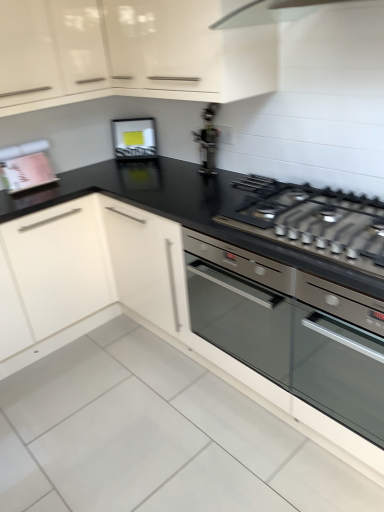
You are a GUI agent. You are given a task and a screenshot of the screen. Output one action in this format:
    pyautogui.click(x=<x>, y=<y>)
    Task: Click on the metallic silver toaster at upper center, placed as the first appliance when sorted from right to left
    Image resolution: width=384 pixels, height=512 pixels.
    Given the screenshot: What is the action you would take?
    pyautogui.click(x=208, y=140)

In order to face pink matte book at upper left, the first appliance from the left, should I rotate leftwards or rightwards?

To align with it, rotate left about 20.873°.

The image size is (384, 512). Describe the element at coordinates (134, 138) in the screenshot. I see `matte black frame at upper center, the 2th appliance positioned from the left` at that location.

What do you see at coordinates (128, 53) in the screenshot? I see `glossy white cabinet at upper center` at bounding box center [128, 53].

I want to click on metallic silver toaster at upper center, the third appliance viewed from the left, so click(208, 140).

Is matte black frame at upper center, the 2th appliance positioned from the left, next to metallic silver toaster at upper center, placed as the first appliance when sorted from right to left?

matte black frame at upper center, the 2th appliance positioned from the left, and metallic silver toaster at upper center, placed as the first appliance when sorted from right to left, are not in contact.

At what (x,y) coordinates should I click in order to perform the action: click on appliance that appears above the matte black frame at upper center, the 2th appliance positioned from the left (from a real-world perspective). Please return your answer as a coordinate pair (x, y). The height and width of the screenshot is (512, 384). Looking at the image, I should click on (208, 140).

Is matte black frame at upper center, the second appliance from the right, smaller than metallic silver toaster at upper center, placed as the first appliance when sorted from right to left?

Yes.

Which object is further away from the camera taking this photo, matte black frame at upper center, the second appliance from the right, or metallic silver toaster at upper center, placed as the first appliance when sorted from right to left?

matte black frame at upper center, the second appliance from the right, is further from the camera.

From the picture: From a real-world perspective, which object rests below the other?

satin silver oven at center is physically lower.

Is matte black frame at upper center, the second appliance from the right, at the left side of satin silver oven at center?

Indeed, matte black frame at upper center, the second appliance from the right, is positioned on the left side of satin silver oven at center.

Which is closer, (134, 139) or (239, 313)?

The point (239, 313) is closer to the camera.

Is matte black frame at upper center, the 2th appliance positioned from the left, in contact with satin silver oven at center?

No, matte black frame at upper center, the 2th appliance positioned from the left, is not touching satin silver oven at center.

Does pink matte book at upper left, which appears as the 3th appliance when viewed from the right, have a larger size compared to glossy white cabinet at upper center?

No.

Starting from the glossy white cabinet at upper center, which appliance is the 2nd one behind? Please provide its 2D coordinates.

[(26, 166)]

From the image's perspective, would you say pink matte book at upper left, which appears as the 3th appliance when viewed from the right, is shown under glossy white cabinet at upper center?

Yes, from the image's perspective, pink matte book at upper left, which appears as the 3th appliance when viewed from the right, is beneath glossy white cabinet at upper center.

Is pink matte book at upper left, the first appliance from the left, not close to glossy white cabinet at upper center?

Actually, pink matte book at upper left, the first appliance from the left, and glossy white cabinet at upper center are a little close together.

Considering the points (209, 166) and (232, 330), which point is in front, point (209, 166) or point (232, 330)?

Point (232, 330)

From the image's perspective, is metallic silver toaster at upper center, the third appliance viewed from the left, on satin silver oven at center?

Indeed, from the image's perspective, metallic silver toaster at upper center, the third appliance viewed from the left, is shown above satin silver oven at center.

Could you tell me if metallic silver toaster at upper center, the third appliance viewed from the left, is facing satin silver oven at center?

No, metallic silver toaster at upper center, the third appliance viewed from the left, is not aimed at satin silver oven at center.

Looking at this image, which object is wider, satin silver oven at center or glossy white cabinet at upper center?

Wider between the two is satin silver oven at center.

Is satin silver oven at center bigger than glossy white cabinet at upper center?

Indeed, satin silver oven at center has a larger size compared to glossy white cabinet at upper center.

Is satin silver oven at center in front of glossy white cabinet at upper center?

Yes.

Is satin silver oven at center oriented away from glossy white cabinet at upper center?

No, glossy white cabinet at upper center is not at the back of satin silver oven at center.

You are a GUI agent. You are given a task and a screenshot of the screen. Output one action in this format:
    pyautogui.click(x=<x>, y=<y>)
    Task: Click on the 2nd appliance to the left of the metallic silver toaster at upper center, the third appliance viewed from the left, starting your count from the anchor
    Image resolution: width=384 pixels, height=512 pixels.
    Given the screenshot: What is the action you would take?
    pyautogui.click(x=26, y=166)

Does pink matte book at upper left, which appears as the 3th appliance when viewed from the right, contain metallic silver toaster at upper center, the third appliance viewed from the left?

No, metallic silver toaster at upper center, the third appliance viewed from the left, is not surrounded by pink matte book at upper left, which appears as the 3th appliance when viewed from the right.

Considering the points (5, 181) and (200, 159), which point is behind, point (5, 181) or point (200, 159)?

Point (200, 159)

Is pink matte book at upper left, the first appliance from the left, turned away from metallic silver toaster at upper center, placed as the first appliance when sorted from right to left?

No.

This screenshot has height=512, width=384. In order to click on appliance that is the 1st object directly below the glossy white cabinet at upper center (from a real-world perspective) in this screenshot , I will do `click(208, 140)`.

Is metallic silver toaster at upper center, the third appliance viewed from the left, oriented away from glossy white cabinet at upper center?

No.

In terms of height, does metallic silver toaster at upper center, the third appliance viewed from the left, look taller or shorter compared to glossy white cabinet at upper center?

Clearly, metallic silver toaster at upper center, the third appliance viewed from the left, is shorter compared to glossy white cabinet at upper center.

Are metallic silver toaster at upper center, the third appliance viewed from the left, and glossy white cabinet at upper center located far from each other?

Actually, metallic silver toaster at upper center, the third appliance viewed from the left, and glossy white cabinet at upper center are a little close together.

The height and width of the screenshot is (512, 384). I want to click on the 1st appliance directly beneath the metallic silver toaster at upper center, placed as the first appliance when sorted from right to left (from a real-world perspective), so click(x=134, y=138).

Image resolution: width=384 pixels, height=512 pixels. I want to click on home appliance in front of the matte black frame at upper center, the 2th appliance positioned from the left, so click(x=290, y=331).

Estimate the real-world distances between objects in this image. Which object is further from satin silver oven at center, pink matte book at upper left, which appears as the 3th appliance when viewed from the right, or matte black frame at upper center, the 2th appliance positioned from the left?

matte black frame at upper center, the 2th appliance positioned from the left, lies further to satin silver oven at center than the other object.

From the image, which object appears to be nearer to glossy white cabinet at upper center, matte black frame at upper center, the 2th appliance positioned from the left, or metallic silver toaster at upper center, placed as the first appliance when sorted from right to left?

metallic silver toaster at upper center, placed as the first appliance when sorted from right to left.

When comparing their distances from matte black frame at upper center, the 2th appliance positioned from the left, does glossy white cabinet at upper center or metallic silver toaster at upper center, placed as the first appliance when sorted from right to left, seem closer?

metallic silver toaster at upper center, placed as the first appliance when sorted from right to left, lies closer to matte black frame at upper center, the 2th appliance positioned from the left, than the other object.

Based on their spatial positions, is metallic silver toaster at upper center, the third appliance viewed from the left, or matte black frame at upper center, the second appliance from the right, closer to satin silver oven at center?

metallic silver toaster at upper center, the third appliance viewed from the left, is positioned closer to the anchor satin silver oven at center.

Considering their positions, is pink matte book at upper left, which appears as the 3th appliance when viewed from the right, positioned further to metallic silver toaster at upper center, placed as the first appliance when sorted from right to left, than glossy white cabinet at upper center?

pink matte book at upper left, which appears as the 3th appliance when viewed from the right, is further to metallic silver toaster at upper center, placed as the first appliance when sorted from right to left.

Estimate the real-world distances between objects in this image. Which object is closer to glossy white cabinet at upper center, metallic silver toaster at upper center, placed as the first appliance when sorted from right to left, or pink matte book at upper left, which appears as the 3th appliance when viewed from the right?

metallic silver toaster at upper center, placed as the first appliance when sorted from right to left, lies closer to glossy white cabinet at upper center than the other object.

In the scene shown: Which object lies nearer to the anchor point glossy white cabinet at upper center, metallic silver toaster at upper center, placed as the first appliance when sorted from right to left, or matte black frame at upper center, the 2th appliance positioned from the left?

metallic silver toaster at upper center, placed as the first appliance when sorted from right to left, lies closer to glossy white cabinet at upper center than the other object.

From the image, which object appears to be nearer to matte black frame at upper center, the second appliance from the right, satin silver oven at center or metallic silver gas stove at center?

metallic silver gas stove at center lies closer to matte black frame at upper center, the second appliance from the right, than the other object.

Locate an element on the screen. cabinetry situated between pink matte book at upper left, the first appliance from the left, and metallic silver gas stove at center from left to right is located at coordinates (128, 53).

The image size is (384, 512). What are the coordinates of `cabinetry between metallic silver gas stove at center and matte black frame at upper center, the 2th appliance positioned from the left, from front to back` in the screenshot? It's located at (128, 53).

Locate an element on the screen. The image size is (384, 512). cabinetry between satin silver oven at center and matte black frame at upper center, the 2th appliance positioned from the left, from front to back is located at coordinates (128, 53).

Where is `cabinetry between pink matte book at upper left, which appears as the 3th appliance when viewed from the right, and satin silver oven at center from left to right`? The image size is (384, 512). cabinetry between pink matte book at upper left, which appears as the 3th appliance when viewed from the right, and satin silver oven at center from left to right is located at coordinates click(128, 53).